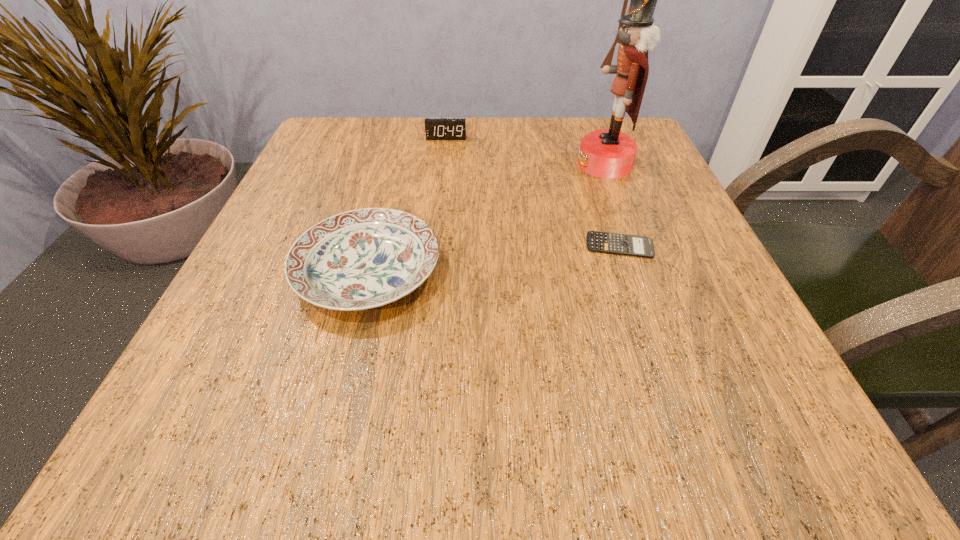
The height and width of the screenshot is (540, 960). In order to click on vacant space located 0.260m on the back of the calculator in this screenshot , I will do `click(589, 156)`.

Image resolution: width=960 pixels, height=540 pixels. What are the coordinates of `nutcracker that is at the far edge` in the screenshot? It's located at (606, 153).

Where is `alarm clock located at the far edge`? Image resolution: width=960 pixels, height=540 pixels. alarm clock located at the far edge is located at coordinates (435, 128).

The width and height of the screenshot is (960, 540). Identify the location of object that is positioned at the left edge. (365, 258).

The image size is (960, 540). Identify the location of nutcracker located in the right edge section of the desktop. (606, 153).

This screenshot has height=540, width=960. What are the coordinates of `calculator at the right edge` in the screenshot? It's located at (605, 242).

Where is `object positioned at the far right corner`? Image resolution: width=960 pixels, height=540 pixels. object positioned at the far right corner is located at coordinates (606, 153).

In the image, there is a desktop. At what (x,y) coordinates should I click in order to perform the action: click on blank space at the far edge. Please return your answer as a coordinate pair (x, y). The width and height of the screenshot is (960, 540). Looking at the image, I should click on (463, 152).

Where is `free point at the near edge`? free point at the near edge is located at coordinates pyautogui.click(x=413, y=427).

Identify the location of free space at the left edge of the desktop. (343, 208).